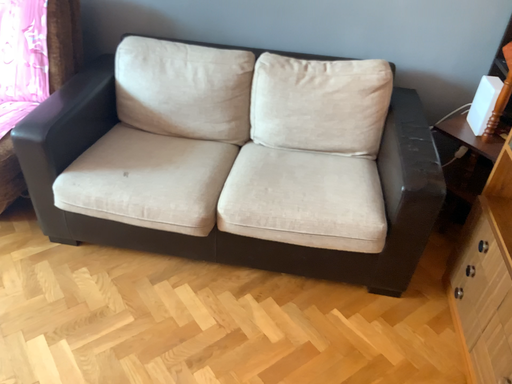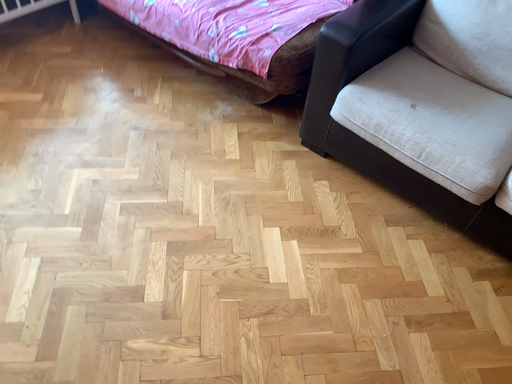
Question: How did the camera likely rotate when shooting the video?

Choices:
 (A) rotated right
 (B) rotated left

Answer: (B)